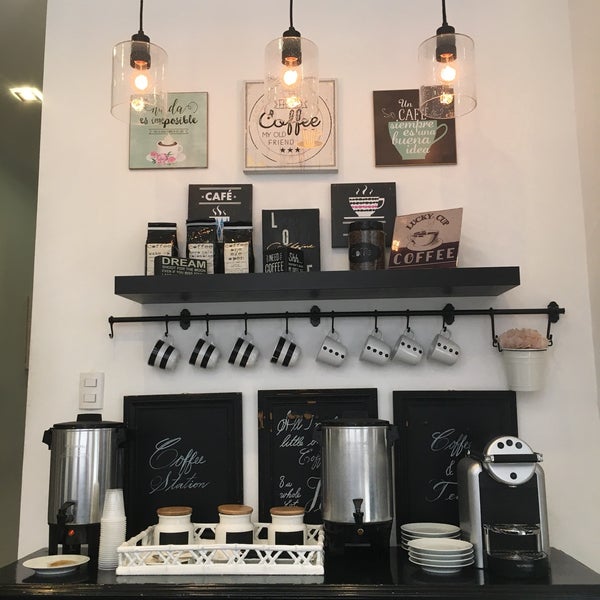
The width and height of the screenshot is (600, 600). Identify the location of black wooden shelf. (319, 283).